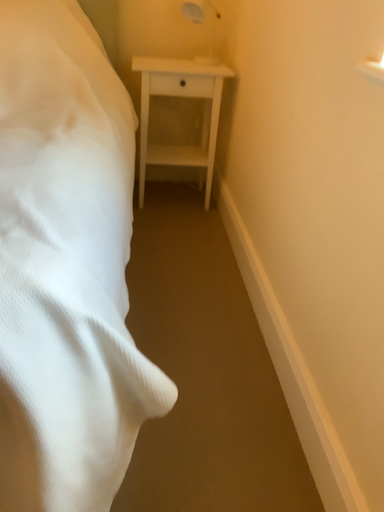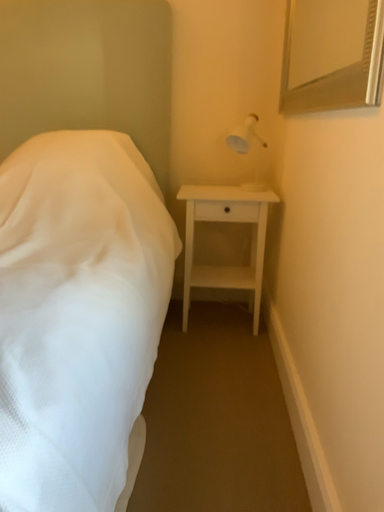
Question: Which way did the camera rotate in the video?

Choices:
 (A) rotated left
 (B) rotated right

Answer: (A)